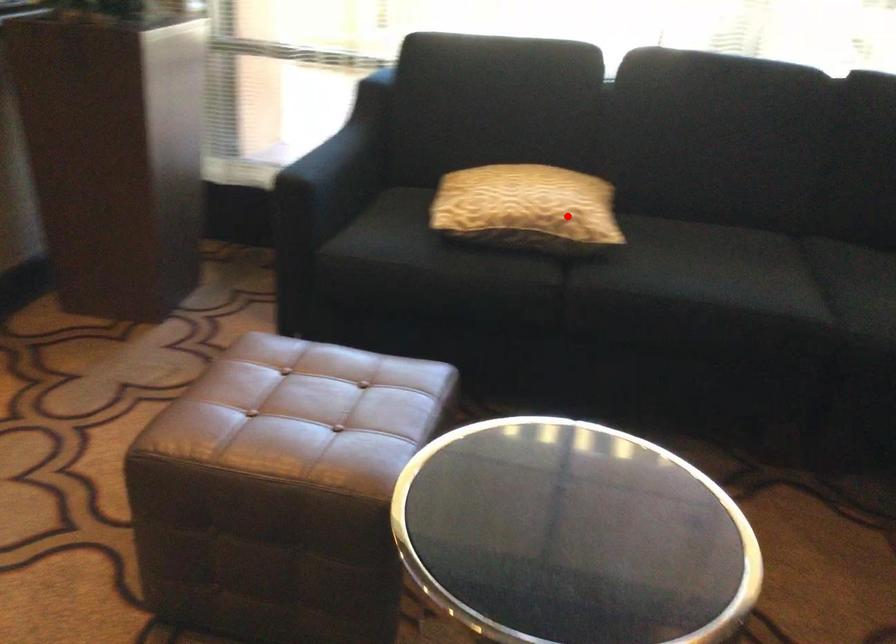
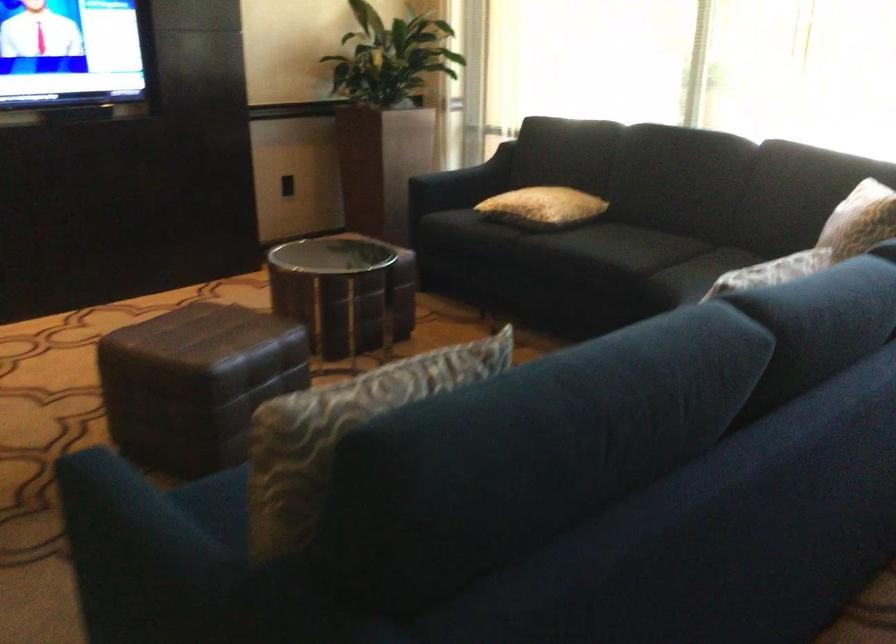
The point at the highlighted location is marked in the first image. Where is the corresponding point in the second image?

(543, 207)